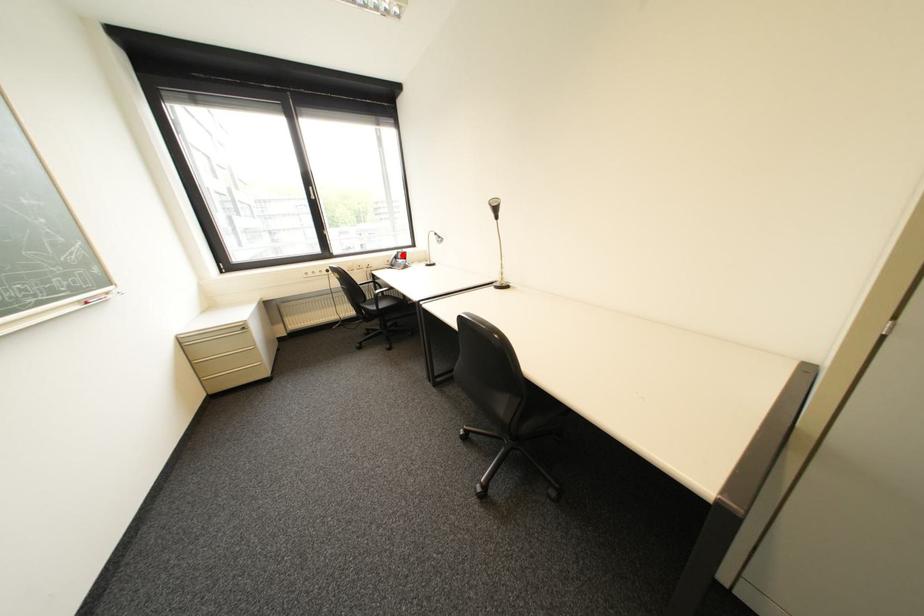
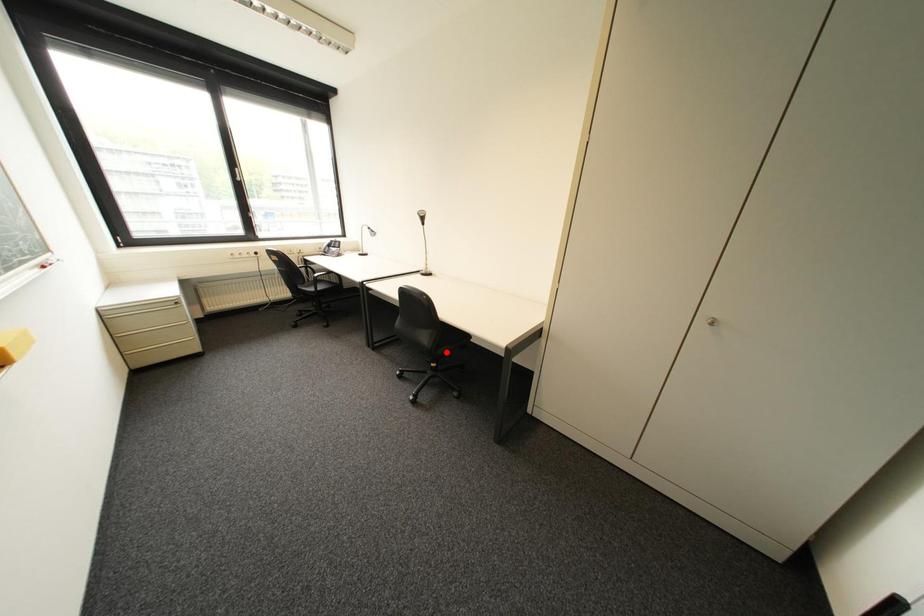
I am providing you with two images of the same scene from different viewpoints. A red point is marked on the first image and another point is marked on the second image. Is the red point in image1 aligned with the point shown in image2?

No